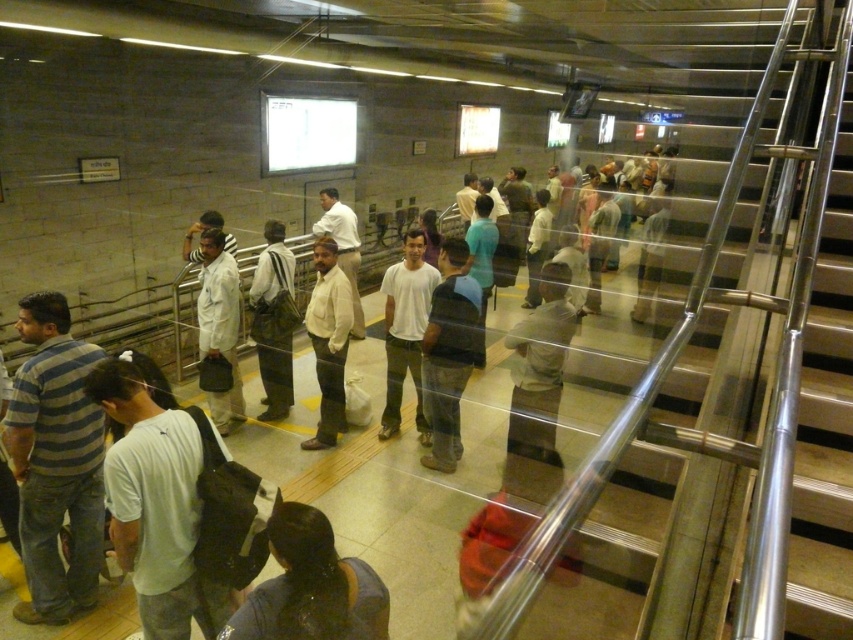
Question: Which point appears closest to the camera in this image?

Choices:
 (A) (289, 364)
 (B) (345, 330)
 (C) (355, 268)

Answer: (B)

Question: Can you confirm if light beige fabric shirt at center is bigger than light brown leather jacket at center?

Choices:
 (A) yes
 (B) no

Answer: (B)

Question: Is dark blue shirt at center below light beige fabric shirt at center?

Choices:
 (A) yes
 (B) no

Answer: (A)

Question: Does striped cotton shirt at center have a lesser width compared to light gray shirt at center?

Choices:
 (A) yes
 (B) no

Answer: (A)

Question: Which of the following is the farthest from the observer?

Choices:
 (A) (238, 305)
 (B) (538, 378)
 (C) (397, 416)
 (D) (141, 429)

Answer: (C)

Question: Based on their relative distances, which object is farther from the dark blue shirt at center?

Choices:
 (A) white matte t-shirt at center
 (B) dark brown hair at lower center
 (C) striped cotton shirt at center

Answer: (B)